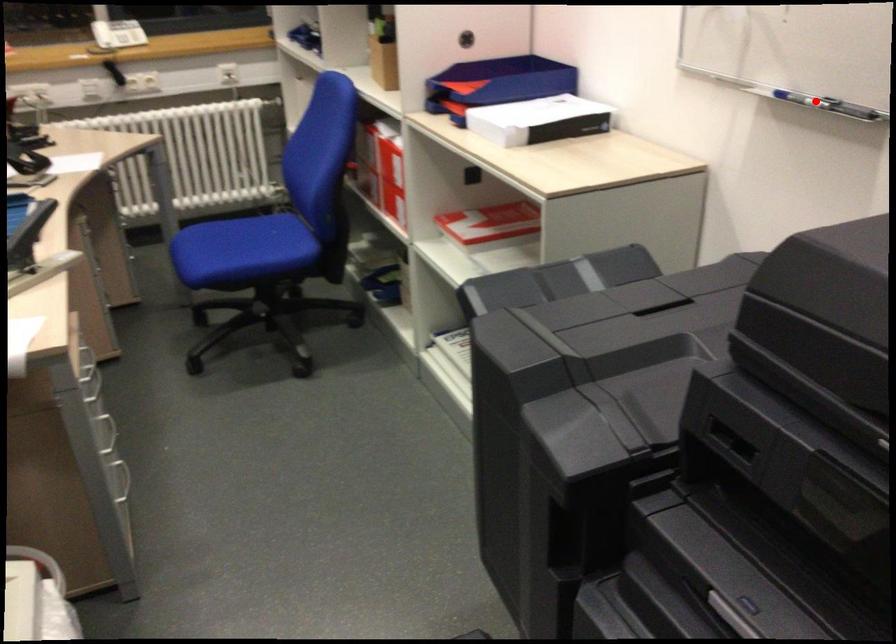
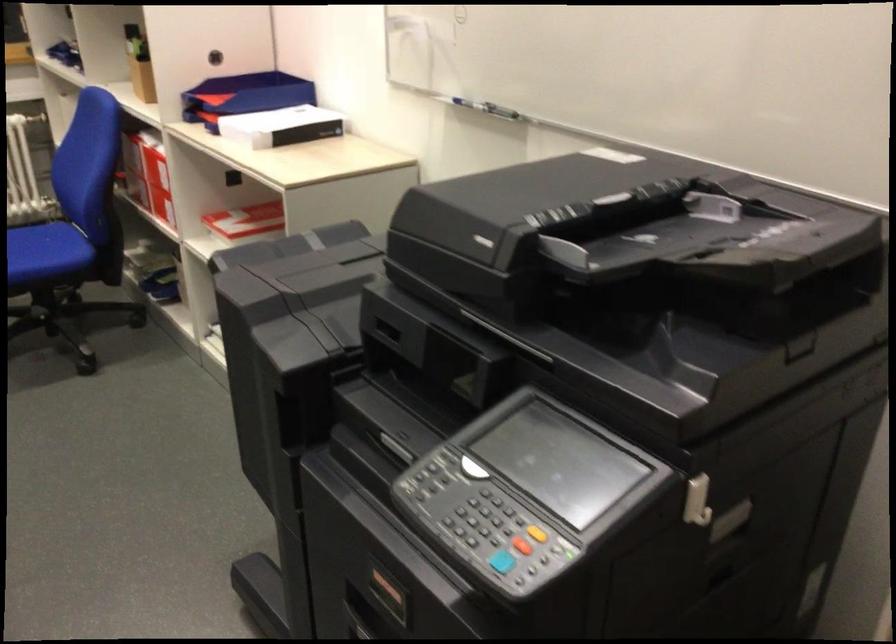
Find the pixel in the second image that matches the highlighted location in the first image.

(478, 105)